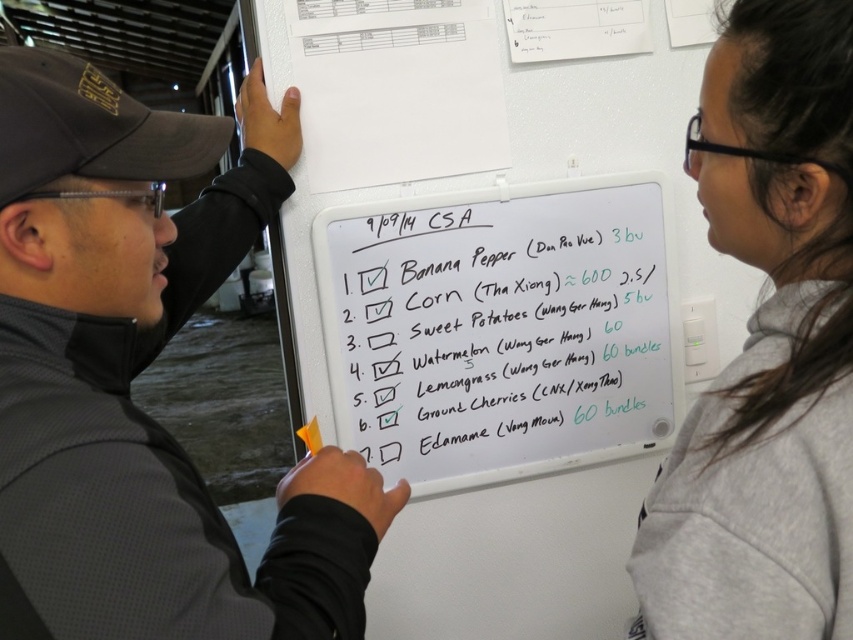
Question: Where is black matte jacket at left located in relation to orange matte highlighter at center in the image?

Choices:
 (A) above
 (B) below

Answer: (A)

Question: Which point is closer to the camera?

Choices:
 (A) (811, 540)
 (B) (218, 625)
 (C) (305, 440)

Answer: (A)

Question: Which of the following is the closest to the observer?

Choices:
 (A) orange matte highlighter at center
 (B) whiteboard at center

Answer: (A)

Question: Which point is closer to the camera?

Choices:
 (A) whiteboard at center
 (B) black matte jacket at left
 (C) gray fleece sweatshirt at upper right

Answer: (B)

Question: Can you confirm if black matte jacket at left is bigger than whiteboard at center?

Choices:
 (A) no
 (B) yes

Answer: (B)

Question: Where is whiteboard at center located in relation to orange matte highlighter at center in the image?

Choices:
 (A) left
 (B) right

Answer: (B)